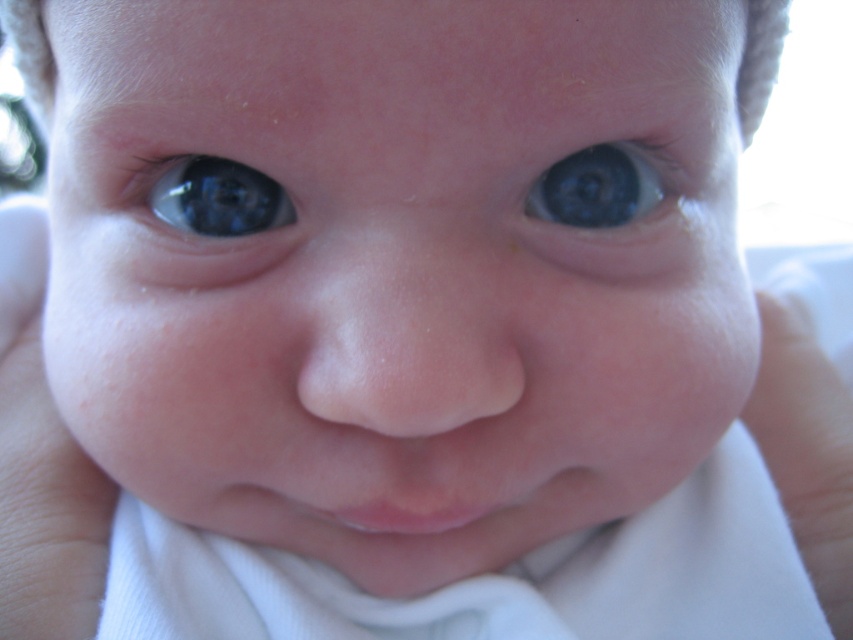
You are a photographer adjusting the focus on a camera lens. You notice two points in the image at coordinates point (x=805, y=394) and point (x=608, y=145). Which point should you focus on to ensure the baby remains sharp in the photo?

You should focus on point (x=805, y=394) because it is closer to the viewer than point (x=608, y=145), ensuring the baby stays sharp.